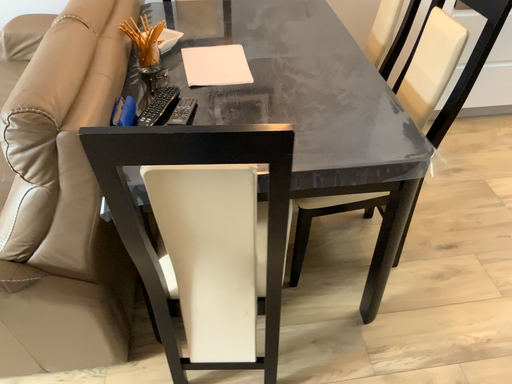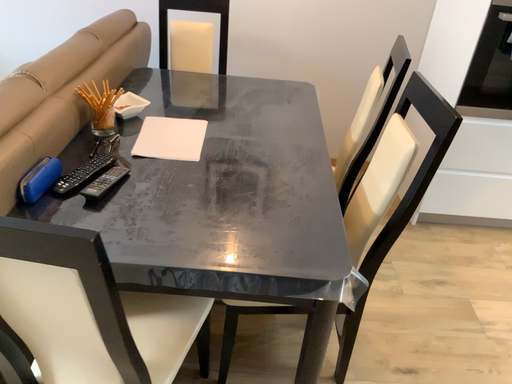
Question: How did the camera likely rotate when shooting the video?

Choices:
 (A) rotated downward
 (B) rotated upward

Answer: (B)